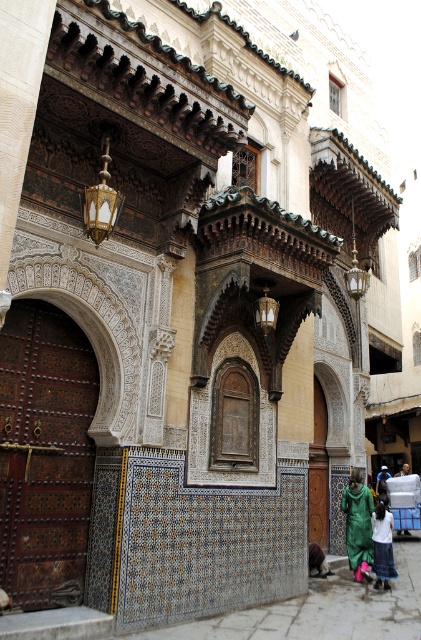
Question: Which point is farther from the camera taking this photo?

Choices:
 (A) (309, 557)
 (B) (381, 477)
 (C) (391, 561)
 (D) (359, 545)

Answer: (B)

Question: Is the position of white cotton shirt at lower center less distant than that of green fabric person at lower right?

Choices:
 (A) yes
 (B) no

Answer: (A)

Question: Does green fabric at lower center have a smaller size compared to green fabric person at lower right?

Choices:
 (A) yes
 (B) no

Answer: (B)

Question: Can you confirm if green fabric at lower center is positioned to the left of green fabric person at lower right?

Choices:
 (A) yes
 (B) no

Answer: (B)

Question: Which point appears farthest from the camera in this image?

Choices:
 (A) tap(311, 566)
 (B) tap(389, 472)

Answer: (B)

Question: Which object appears closest to the camera in this image?

Choices:
 (A) white cotton shirt at lower center
 (B) green fabric at lower center
 (C) dark green fabric at lower center
 (D) green fabric person at lower right

Answer: (A)